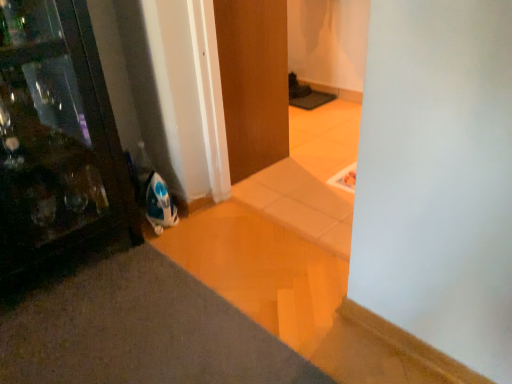
What is the approximate width of wooden door at center?

The width of wooden door at center is 17.87 inches.

The height and width of the screenshot is (384, 512). What do you see at coordinates (253, 82) in the screenshot?
I see `wooden door at center` at bounding box center [253, 82].

Image resolution: width=512 pixels, height=384 pixels. In order to click on wooden door at center in this screenshot , I will do `click(253, 82)`.

What is the approximate height of wooden door at center?

wooden door at center is 87.41 centimeters tall.

Find the location of a particular element. This screenshot has height=384, width=512. wooden door at center is located at coordinates (253, 82).